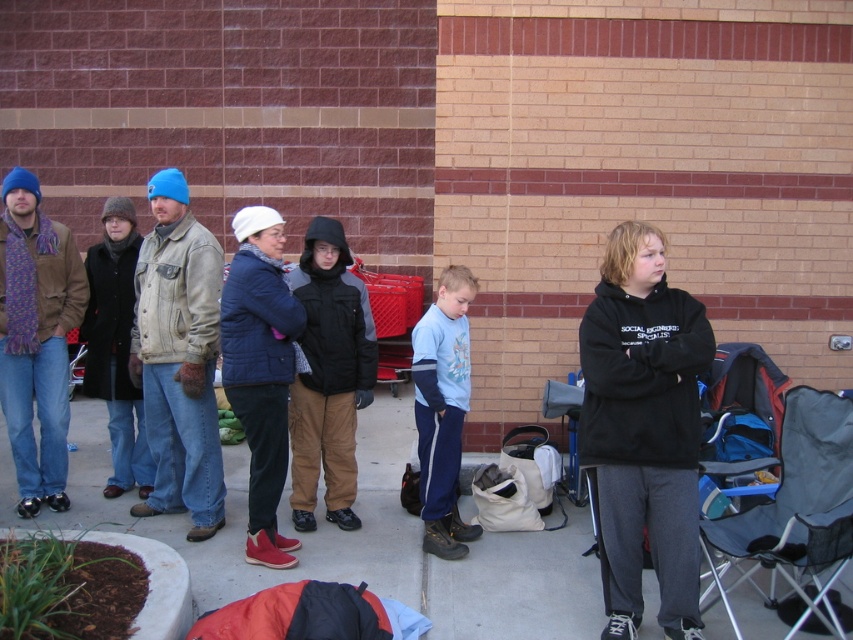
Consider the image. You are organizing a small outdoor event and need to set up a chair for a guest. The guest prefers sitting behind the denim jacket at center to avoid direct sunlight. Can the black fabric folding chair at lower right be positioned there?

Yes, the black fabric folding chair at lower right can be positioned behind the denim jacket at center since it is already located behind that jacket.

You are standing in front of the brick building and want to place a small potted plant between the concrete pavement at center and the black fabric folding chair at lower right. Based on their positions, where should you place it?

The concrete pavement at center is to the left of the black fabric folding chair at lower right, so you should place the potted plant between them on the left side of the chair and the right side of the pavement.

You are a delivery person who needs to place a large package on the ground. The package is too heavy to lift, so you must push it from your current position. You see the concrete pavement at center and the denim jacket at center. Which surface can you push the package onto without it getting damaged?

The concrete pavement at center is bigger than the denim jacket at center, so you can push the package onto the concrete pavement at center since it has enough space to accommodate the large package without damaging it.